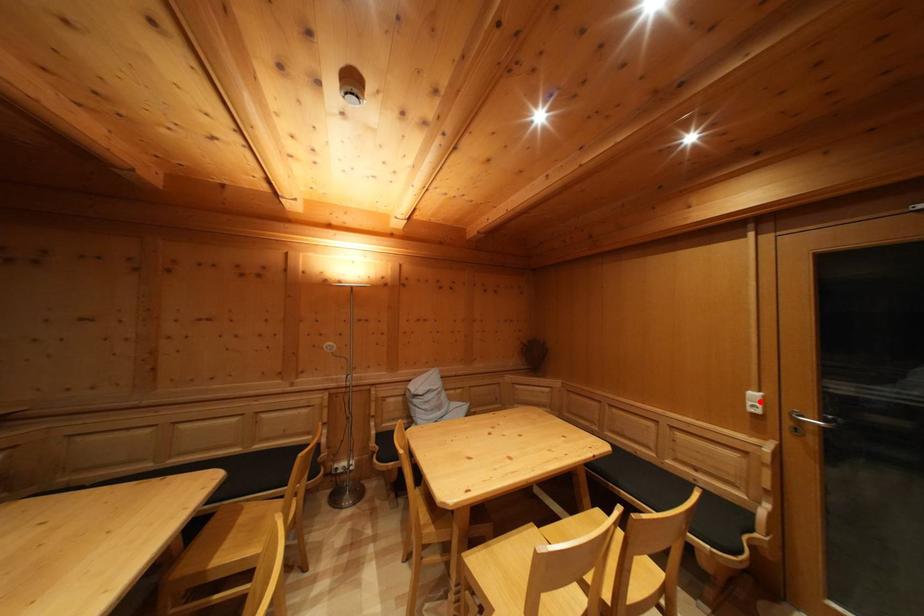
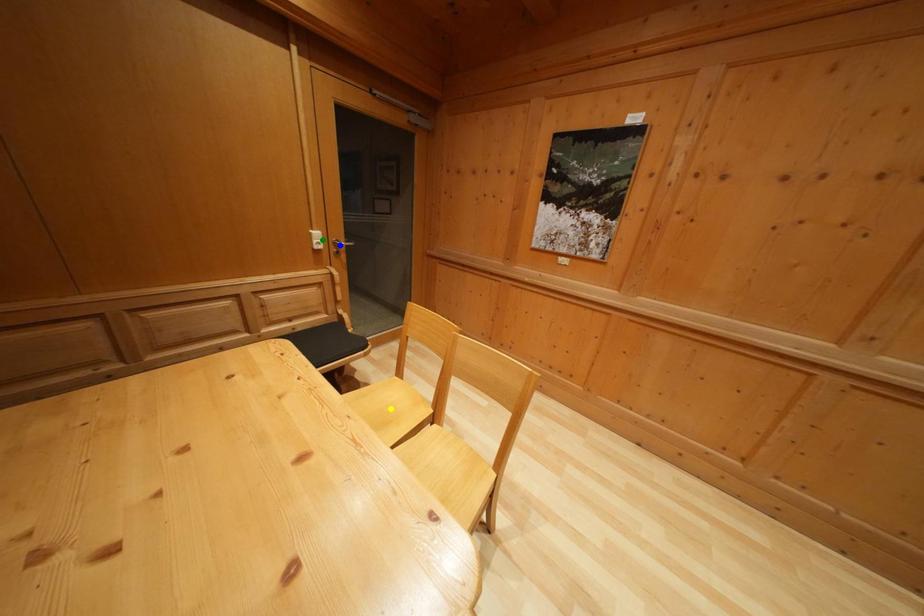
Question: I am providing you with two images of the same scene from different viewpoints. A red point is marked on the first image. You are given multiple points on the second image. Which mark in image 2 goes with the point in image 1?

Choices:
 (A) blue point
 (B) yellow point
 (C) green point

Answer: (C)